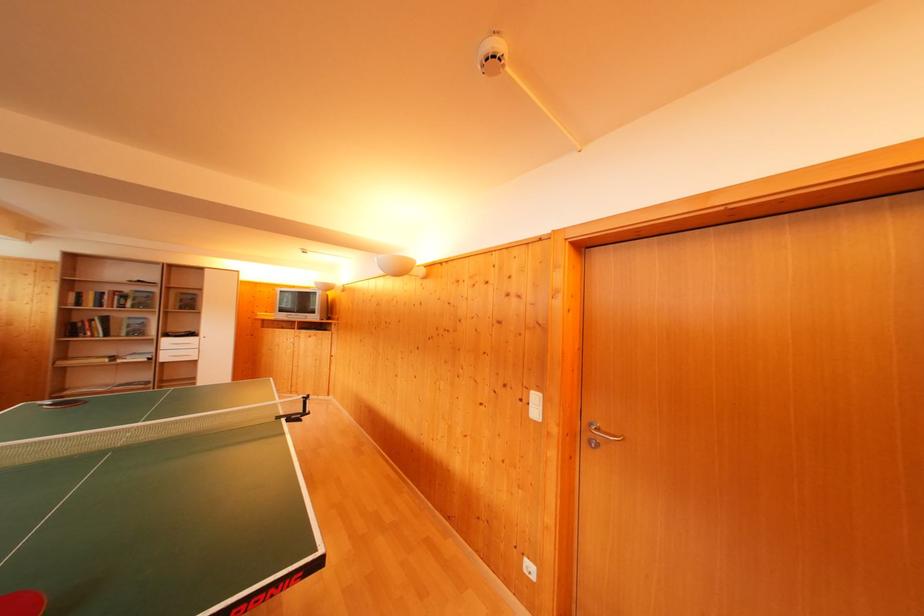
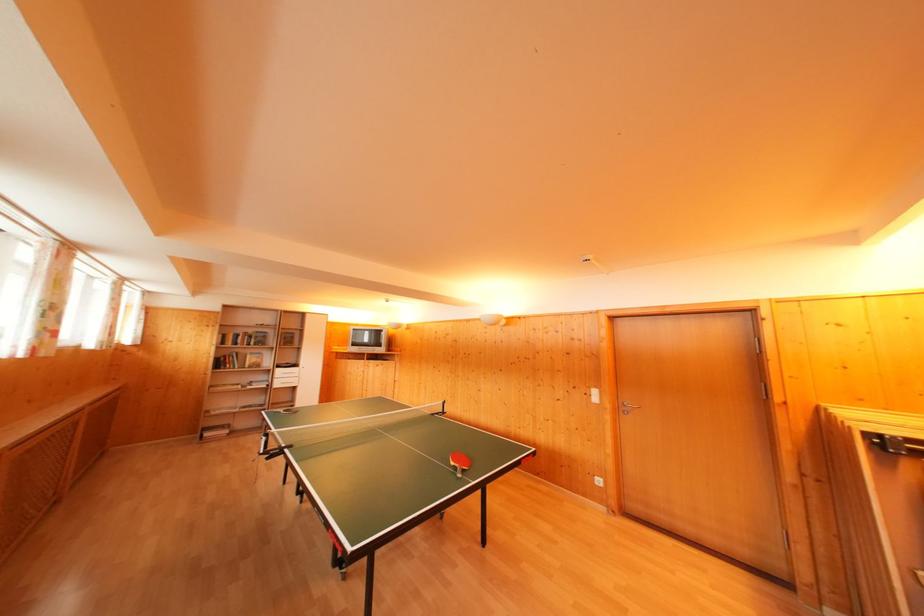
What movement of the cameraman would produce the second image?

The cameraman moved toward left, backward.